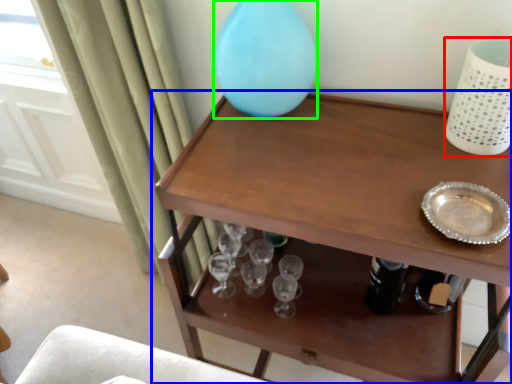
Question: Based on their relative distances, which object is nearer to vase (highlighted by a red box)? Choose from table (highlighted by a blue box) and vase (highlighted by a green box).

Choices:
 (A) table
 (B) vase

Answer: (A)